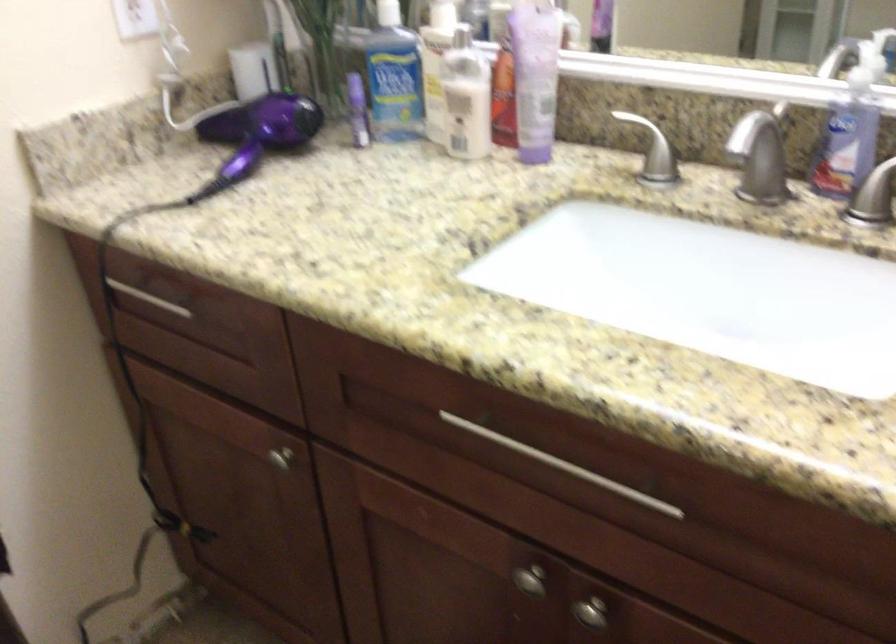
What do you see at coordinates (846, 145) in the screenshot? This screenshot has height=644, width=896. I see `the soap pump dispenser` at bounding box center [846, 145].